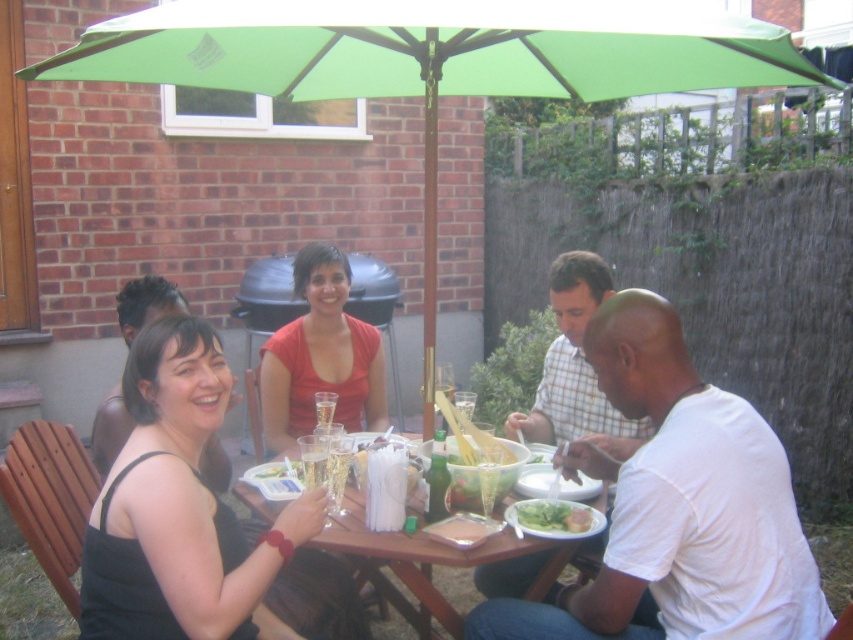
Between white cotton shirt at lower right and matte red shirt at center, which one has more height?

white cotton shirt at lower right

Can you confirm if white cotton shirt at lower right is taller than matte red shirt at center?

Yes.

You are a GUI agent. You are given a task and a screenshot of the screen. Output one action in this format:
    pyautogui.click(x=<x>, y=<y>)
    Task: Click on the white cotton shirt at lower right
    
    Given the screenshot: What is the action you would take?
    click(672, 509)

Is black fabric dress at lower left thinner than wooden table at center?

Yes.

Is black fabric dress at lower left smaller than wooden table at center?

Correct, black fabric dress at lower left occupies less space than wooden table at center.

Where is `black fabric dress at lower left`? black fabric dress at lower left is located at coordinates (178, 509).

Can you confirm if green fabric umbrella at center is wider than wooden table at center?

Yes, green fabric umbrella at center is wider than wooden table at center.

Can you confirm if green fabric umbrella at center is bigger than wooden table at center?

Indeed, green fabric umbrella at center has a larger size compared to wooden table at center.

The width and height of the screenshot is (853, 640). Describe the element at coordinates (434, 61) in the screenshot. I see `green fabric umbrella at center` at that location.

The image size is (853, 640). Find the location of `green fabric umbrella at center`. green fabric umbrella at center is located at coordinates (434, 61).